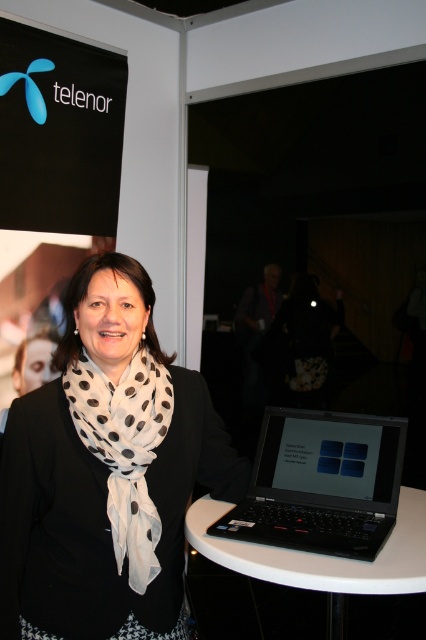
You are a photographer at the exhibition. You need to position yourself so that the white glossy round table at center and the white sheer scarf at center are both in frame. The minimum distance between the camera and the objects is 5 feet. Can you stand at the current position and take the photo?

The white glossy round table at center is 5.11 feet from the white sheer scarf at center. Since the minimum required distance is 5 feet, standing at the current position allows both objects to be within the frame as the distance between them meets the requirement.

You are organizing a small event and need to place a decorative centerpiece on the white glossy round table at center. Considering the size of the white sheer scarf at center, will the table be able to accommodate the centerpiece without it overlapping the scarf?

The white glossy round table at center has a larger size compared to the white sheer scarf at center. Since the table is bigger, it can accommodate the centerpiece without overlapping the scarf as long as it is placed appropriately.

You are a photographer at the exhibition. You need to adjust your camera focus so that both the black matte laptop at lower right and the white sheer scarf at center are in focus. Which object should you focus on first to ensure both are sharp?

You should focus on the white sheer scarf at center first because it is closer to you than the black matte laptop at lower right, which is further away. By focusing on the closer object, the depth of field will extend to include the farther object as well.